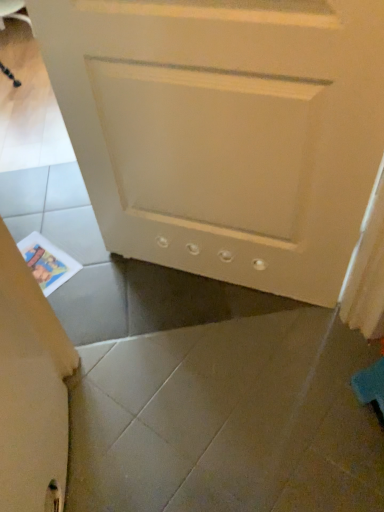
Question: Is white matte door at center not close to printed paper at lower left?

Choices:
 (A) no
 (B) yes

Answer: (A)

Question: Can you see white matte door at center touching printed paper at lower left?

Choices:
 (A) no
 (B) yes

Answer: (A)

Question: Is white matte door at center wider than printed paper at lower left?

Choices:
 (A) yes
 (B) no

Answer: (B)

Question: Is white matte door at center positioned beyond the bounds of printed paper at lower left?

Choices:
 (A) no
 (B) yes

Answer: (B)

Question: Does white matte door at center come behind printed paper at lower left?

Choices:
 (A) no
 (B) yes

Answer: (A)

Question: Considering the relative positions of white matte door at center and printed paper at lower left in the image provided, is white matte door at center to the left of printed paper at lower left from the viewer's perspective?

Choices:
 (A) no
 (B) yes

Answer: (A)

Question: Does printed paper at lower left have a lesser height compared to white matte door at center?

Choices:
 (A) no
 (B) yes

Answer: (B)

Question: From a real-world perspective, is printed paper at lower left located beneath white matte door at center?

Choices:
 (A) yes
 (B) no

Answer: (A)

Question: Is printed paper at lower left in contact with white matte door at center?

Choices:
 (A) no
 (B) yes

Answer: (A)

Question: Does printed paper at lower left have a greater width compared to white matte door at center?

Choices:
 (A) no
 (B) yes

Answer: (B)

Question: Considering the relative sizes of printed paper at lower left and white matte door at center in the image provided, is printed paper at lower left smaller than white matte door at center?

Choices:
 (A) yes
 (B) no

Answer: (A)

Question: Could you tell me if printed paper at lower left is facing white matte door at center?

Choices:
 (A) yes
 (B) no

Answer: (B)

Question: From the image's perspective, is white matte door at center positioned above or below printed paper at lower left?

Choices:
 (A) above
 (B) below

Answer: (A)